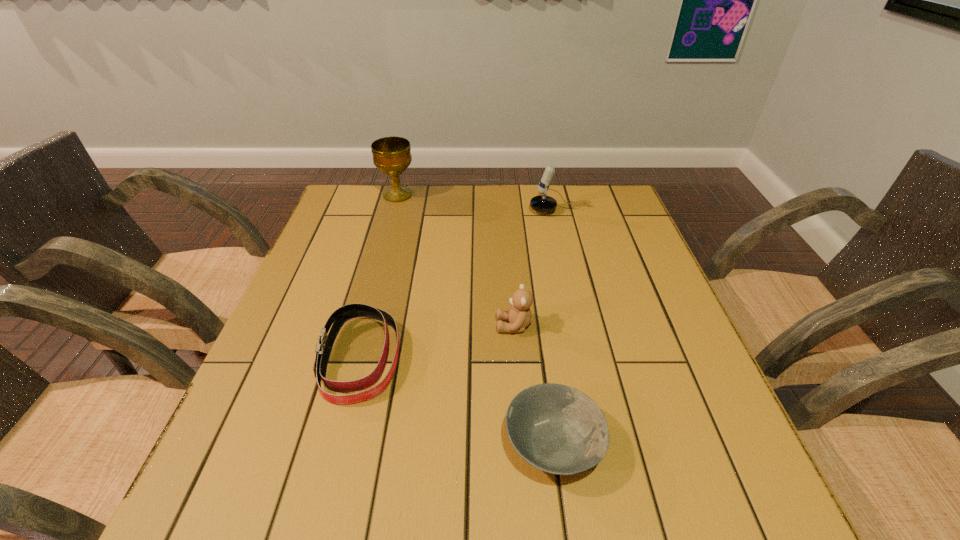
Where is `chalice`? The height and width of the screenshot is (540, 960). chalice is located at coordinates (392, 155).

This screenshot has width=960, height=540. Find the location of `microphone`. microphone is located at coordinates (542, 203).

Identify the location of teddy bear. (519, 315).

Where is `dog collar`? dog collar is located at coordinates (341, 315).

What are the coordinates of `bowl` in the screenshot? It's located at (557, 429).

Where is `vacant space located on the right of the chalice`? The image size is (960, 540). vacant space located on the right of the chalice is located at coordinates (504, 195).

Find the location of a particular element. The width and height of the screenshot is (960, 540). free space located on the right of the microphone is located at coordinates (612, 211).

Where is `vacant region located on the front-facing side of the third tallest object`? The image size is (960, 540). vacant region located on the front-facing side of the third tallest object is located at coordinates (388, 326).

The width and height of the screenshot is (960, 540). In order to click on vacant space located on the front-facing side of the third tallest object in this screenshot , I will do `click(433, 326)`.

This screenshot has height=540, width=960. Find the location of `vacant space positioned 0.050m on the front-facing side of the third tallest object`. vacant space positioned 0.050m on the front-facing side of the third tallest object is located at coordinates (474, 326).